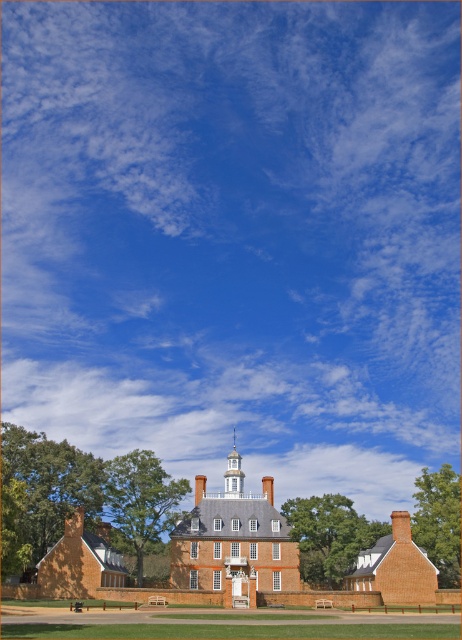
Does red brick chimney at center appear on the right side of brick chimney at center?

Result: In fact, red brick chimney at center is to the left of brick chimney at center.

Does red brick chimney at center have a smaller size compared to brick chimney at center?

No.

This screenshot has height=640, width=462. What do you see at coordinates (200, 486) in the screenshot? I see `red brick chimney at center` at bounding box center [200, 486].

Locate an element on the screen. red brick chimney at center is located at coordinates (200, 486).